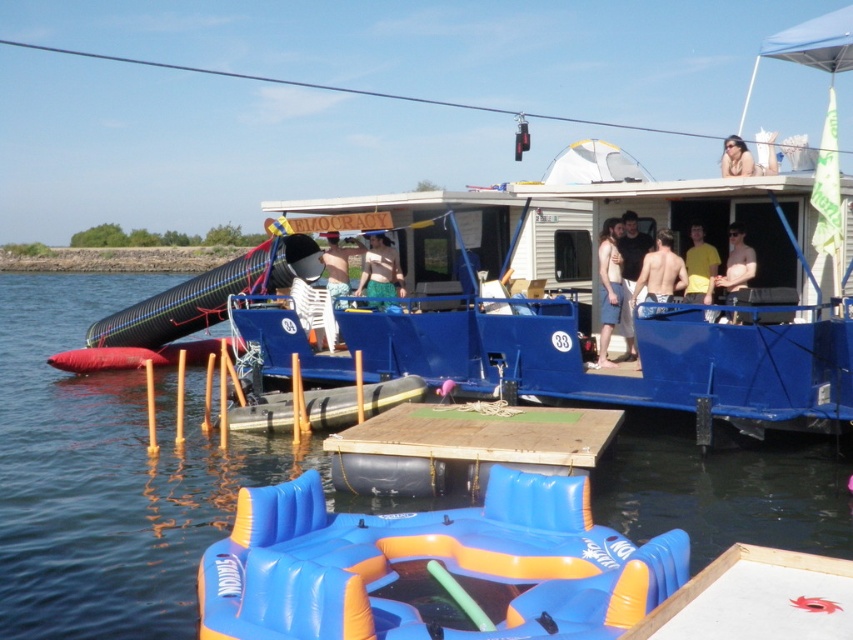
You are a photographer trying to capture a clear shot of the yellow matte shirt at center without the green textured shorts at center blocking it. Is this possible given their positions?

The green textured shorts at center is positioned over the yellow matte shirt at center, so it would block the view. To capture the yellow matte shirt at center clearly, you would need to adjust the angle or have the green textured shorts at center moved.

You are a lifeguard standing on the pontoon boat and need to reach both the green textured shorts at center and the camouflage shorts at center to check for safety. Given that your reach is 70 centimeters, can you comfortably reach both items without moving your position?

The distance between the green textured shorts at center and the camouflage shorts at center is 76.85 centimeters. Since your reach is 70 centimeters, you cannot comfortably reach both items without moving your position because the distance exceeds your reach.